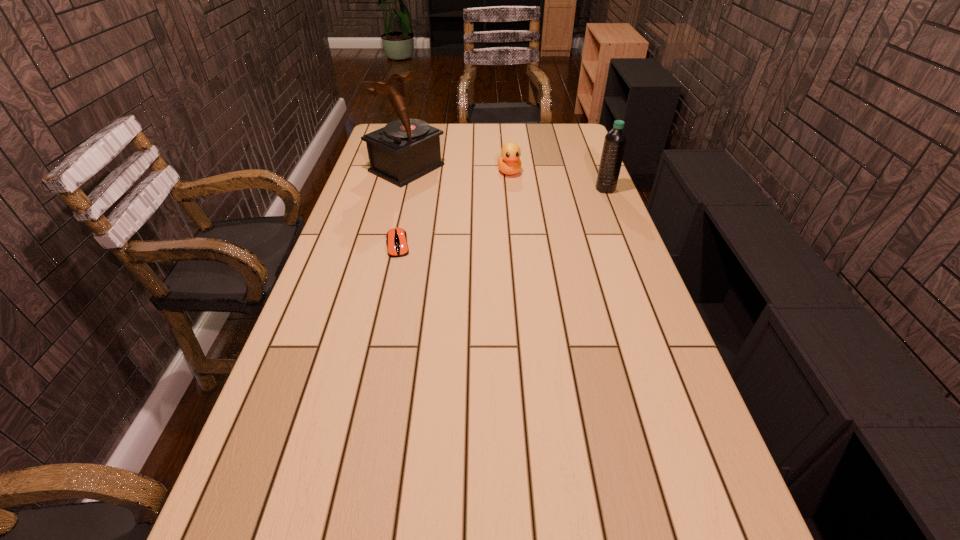
I want to click on the nearest object, so click(x=397, y=246).

Locate an element on the screen. Image resolution: width=960 pixels, height=540 pixels. the shortest object is located at coordinates (397, 246).

I want to click on water bottle, so click(615, 140).

The image size is (960, 540). Find the location of `the third shortest object`. the third shortest object is located at coordinates (615, 140).

Image resolution: width=960 pixels, height=540 pixels. I want to click on the third tallest object, so click(509, 163).

Where is `the third object from left to right`? The image size is (960, 540). the third object from left to right is located at coordinates (509, 163).

The width and height of the screenshot is (960, 540). I want to click on phonograph_record, so click(404, 150).

At what (x,y) coordinates should I click in order to perform the action: click on vacant space situated on the back of the nearest object. Please return your answer as a coordinate pair (x, y). The width and height of the screenshot is (960, 540). Looking at the image, I should click on (415, 172).

Where is `blank space located 0.380m on the back of the rightmost object`? The width and height of the screenshot is (960, 540). blank space located 0.380m on the back of the rightmost object is located at coordinates (586, 139).

Locate an element on the screen. The width and height of the screenshot is (960, 540). vacant region located on the face of the third tallest object is located at coordinates (534, 244).